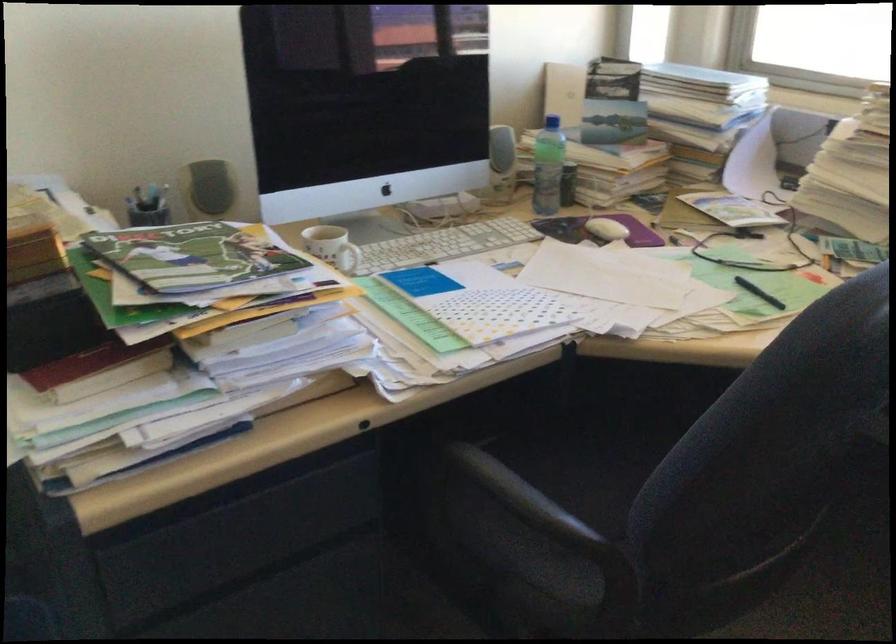
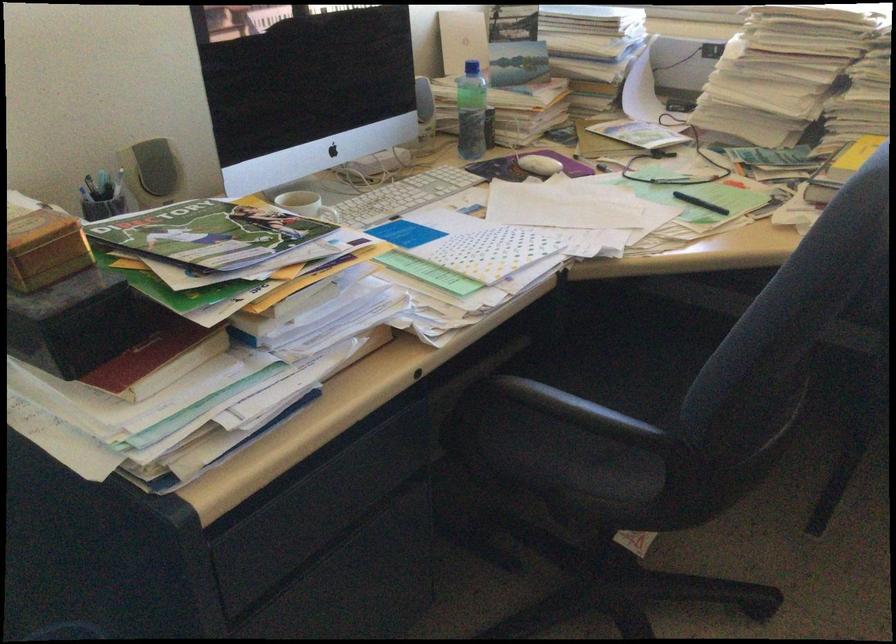
The point at (598, 230) is marked in the first image. Where is the corresponding point in the second image?

(538, 165)